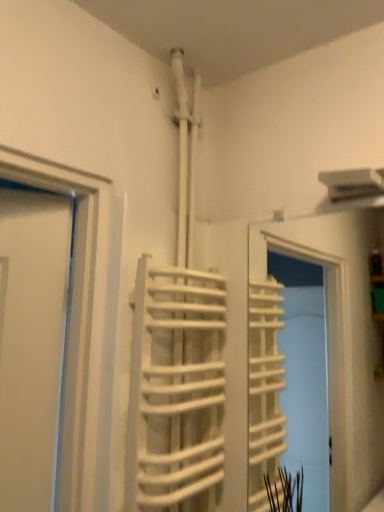
Question: Based on their positions, is white matte stair at center located to the left or right of green matte plant at lower right?

Choices:
 (A) left
 (B) right

Answer: (A)

Question: From the image's perspective, is white matte stair at center positioned above or below green matte plant at lower right?

Choices:
 (A) above
 (B) below

Answer: (A)

Question: Relative to green matte plant at lower right, is white matte stair at center in front or behind?

Choices:
 (A) front
 (B) behind

Answer: (A)

Question: Looking at the image, does green matte plant at lower right seem bigger or smaller compared to white matte stair at center?

Choices:
 (A) big
 (B) small

Answer: (B)

Question: From the image's perspective, is green matte plant at lower right positioned above or below white matte stair at center?

Choices:
 (A) below
 (B) above

Answer: (A)

Question: Is green matte plant at lower right spatially inside white matte stair at center, or outside of it?

Choices:
 (A) inside
 (B) outside

Answer: (B)

Question: Is point (291, 494) positioned closer to the camera than point (173, 370)?

Choices:
 (A) farther
 (B) closer

Answer: (B)